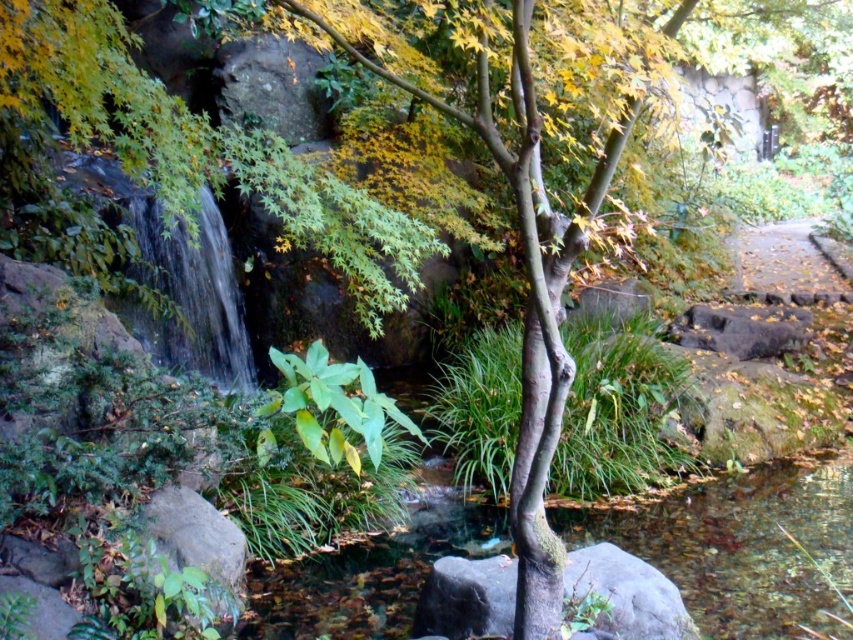
You are standing in a garden and see the clear water at center and the gray rough rock at center. Which object is positioned to the left?

The clear water at center is to the left of the gray rough rock at center.

You are a hiker who wants to take a photo of the gray rough rock at center and the brown dirt path at right. Which object should you position closer to the left side of your camera frame to include both in the photo?

To include both the gray rough rock at center and the brown dirt path at right in your photo, position the gray rough rock at center closer to the left side of your camera frame since it is located to the left of the brown dirt path at right.